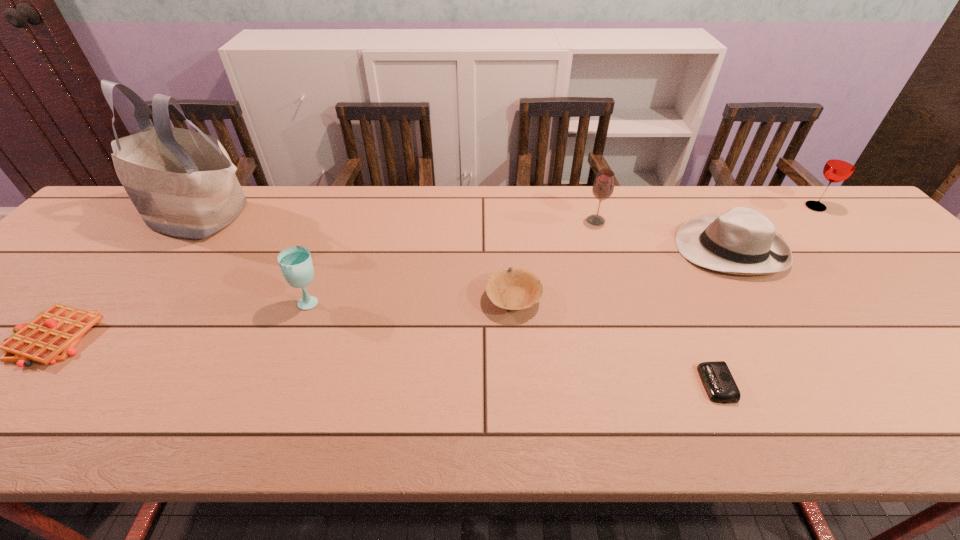
Identify the location of shopping bag. Image resolution: width=960 pixels, height=540 pixels. (182, 182).

Identify the location of the rightmost glass. (840, 166).

Where is `the farthest glass`? This screenshot has height=540, width=960. the farthest glass is located at coordinates (840, 166).

Find the location of a particular element. the fifth object from left to right is located at coordinates (603, 186).

Identify the location of the second nearest glass. Image resolution: width=960 pixels, height=540 pixels. (603, 186).

Where is `the nearest glass`? This screenshot has width=960, height=540. the nearest glass is located at coordinates click(x=295, y=262).

Identify the location of the leftmost glass. (295, 262).

Locate an element on the screen. Image resolution: width=960 pixels, height=540 pixels. the seventh object from left to right is located at coordinates (742, 241).

Where is `the fifth tallest object`? the fifth tallest object is located at coordinates (742, 241).

Locate an element on the screen. This screenshot has width=960, height=540. bowl is located at coordinates (512, 288).